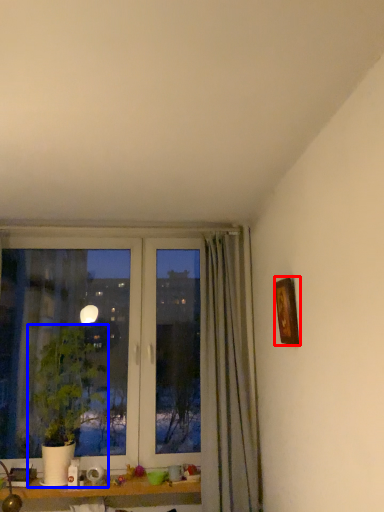
Question: Which point is further to the camera, picture frame (highlighted by a red box) or houseplant (highlighted by a blue box)?

Choices:
 (A) picture frame
 (B) houseplant

Answer: (B)